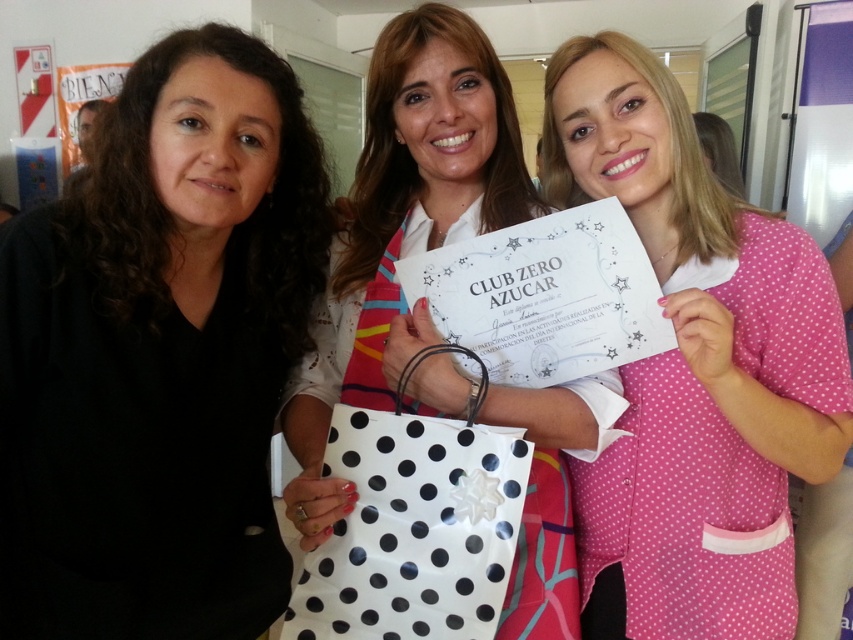
In the scene, there are two items at the center of the image. The black matte shirt at center and the white dotted paper bag at center. Which one is positioned to the left?

The black matte shirt at center is positioned to the left of the white dotted paper bag at center.

You are a photographer trying to capture a closeup of the black matte shirt at center and the white paper certificate at center. Which object should you zoom in on first to ensure it fits entirely in the frame?

The black matte shirt at center has a lesser width compared to white paper certificate at center, so you should zoom in on the white paper certificate at center first to ensure it fits entirely in the frame.